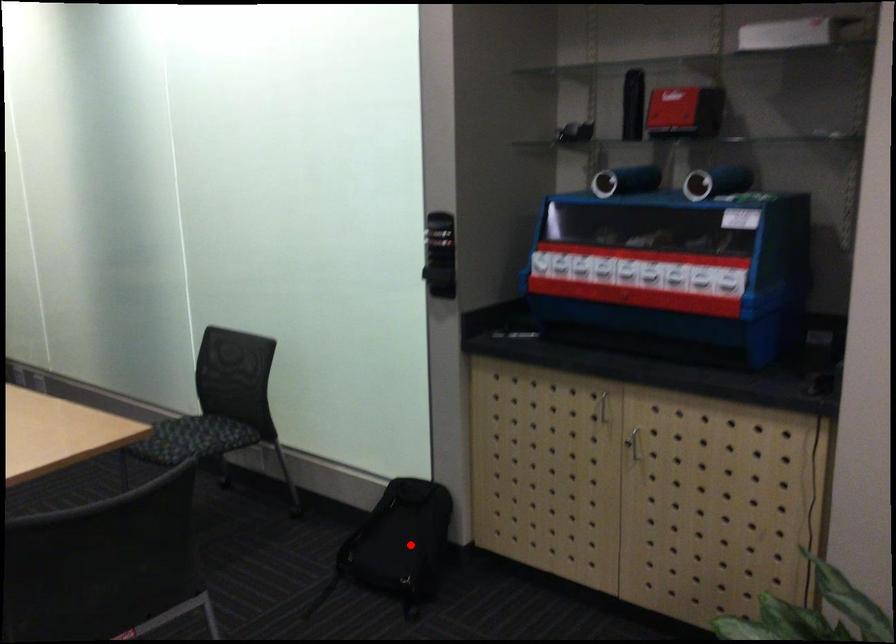
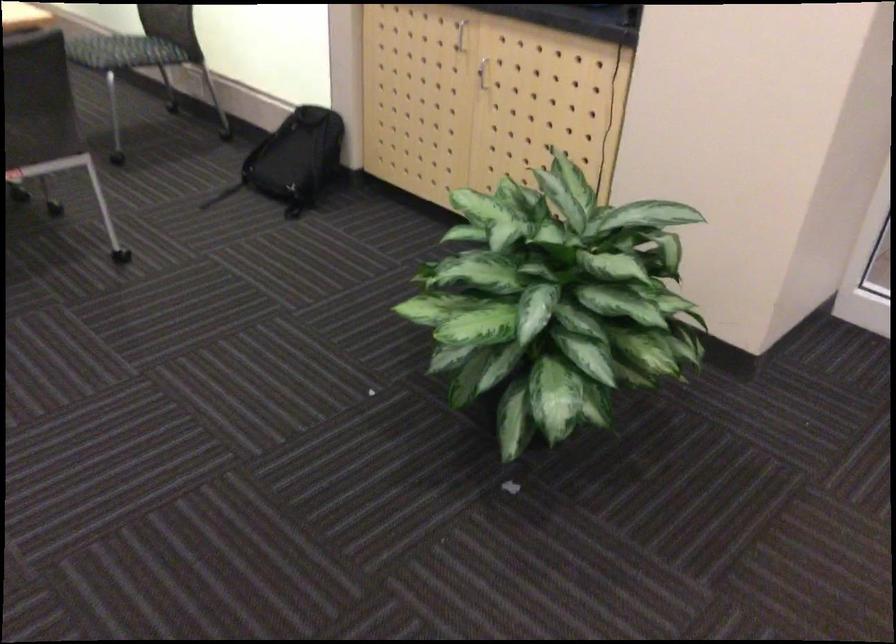
Question: I am providing you with two images of the same scene from different viewpoints. In image1, a red point is highlighted. Considering the same 3D point in image2, which of the following is correct?

Choices:
 (A) It is closer
 (B) It is farther

Answer: (B)